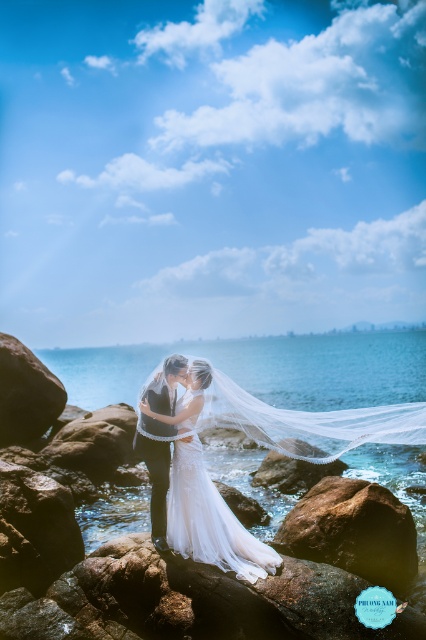
You are a photographer positioned at the shoreline capturing the wedding scene. You want to ensure the clear blue water at center is in focus while maintaining the couple in the background. Given the depth of field, can you estimate if the water will be sharp enough if your focus point is set 5 meters away from you?

The clear blue water at center is 8.58 meters away from the viewer. If the focus point is set at 5 meters, the depth of field might not extend far enough to keep the water in sharp focus, resulting in potential blurriness.

You are a photographer taking pictures of the wedding scene. You need to ensure that the brown rough rock at lower center and the white lace dress at center are both visible in the frame. Based on their positions, which object is to the right of the other?

The brown rough rock at lower center is positioned on the right side of white lace dress at center.